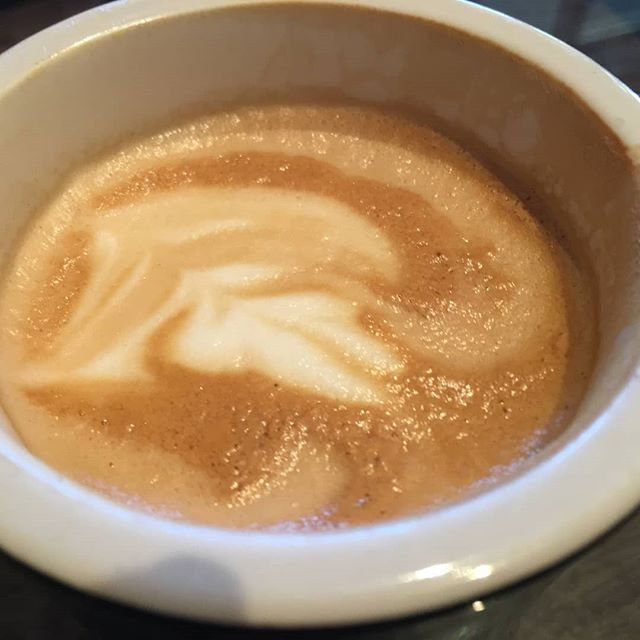
Where is `white stoneware cup`? white stoneware cup is located at coordinates (344, 571), (98, 86).